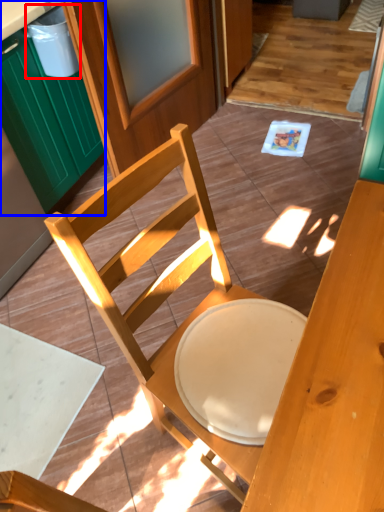
Question: Which object is further to the camera taking this photo, trash bin/can (highlighted by a red box) or cabinetry (highlighted by a blue box)?

Choices:
 (A) trash bin/can
 (B) cabinetry

Answer: (A)